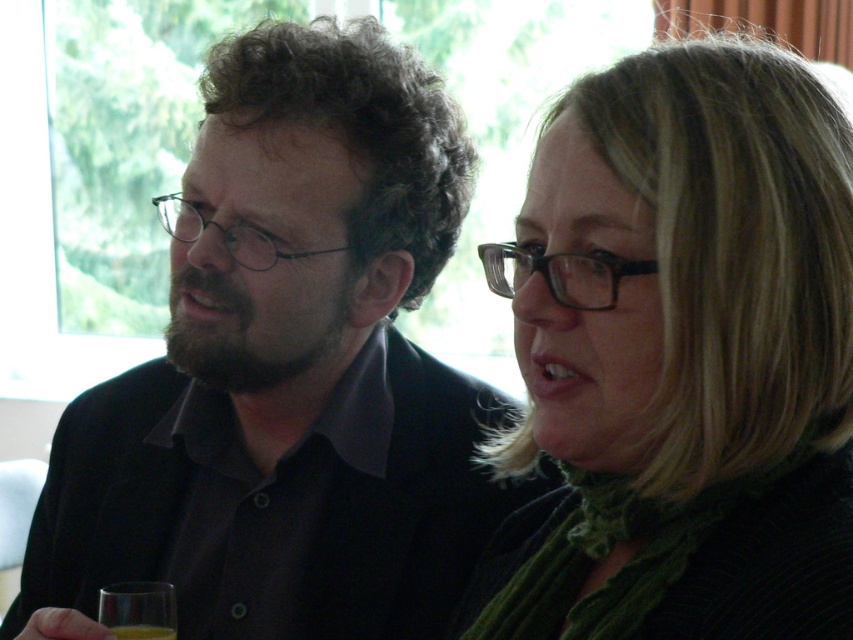
Question: From the image, what is the correct spatial relationship of matte black shirt at center in relation to transparent glass at lower left?

Choices:
 (A) below
 (B) above

Answer: (B)

Question: Is green textured scarf at center above transparent glass at lower left?

Choices:
 (A) no
 (B) yes

Answer: (B)

Question: Is matte black shirt at center positioned behind translucent yellow liquid at lower left?

Choices:
 (A) yes
 (B) no

Answer: (B)

Question: Among these points, which one is farthest from the camera?

Choices:
 (A) (364, 525)
 (B) (137, 636)
 (C) (111, 593)
 (D) (596, 452)

Answer: (A)

Question: Which object is closer to the camera taking this photo?

Choices:
 (A) green textured scarf at center
 (B) translucent yellow liquid at lower left
 (C) matte black shirt at center
 (D) transparent glass at lower left

Answer: (A)

Question: Among these points, which one is farthest from the camera?

Choices:
 (A) (753, 58)
 (B) (103, 602)
 (C) (264, 157)

Answer: (C)